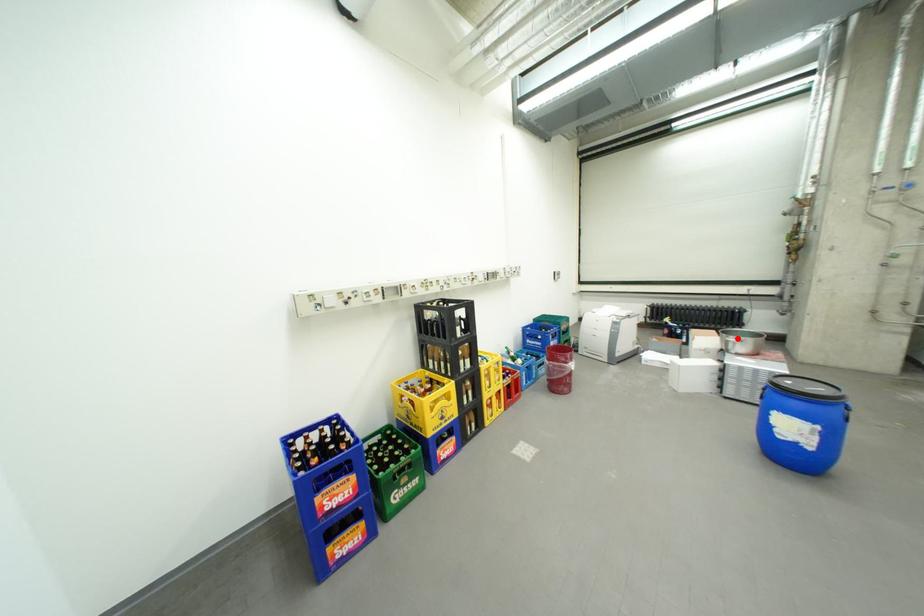
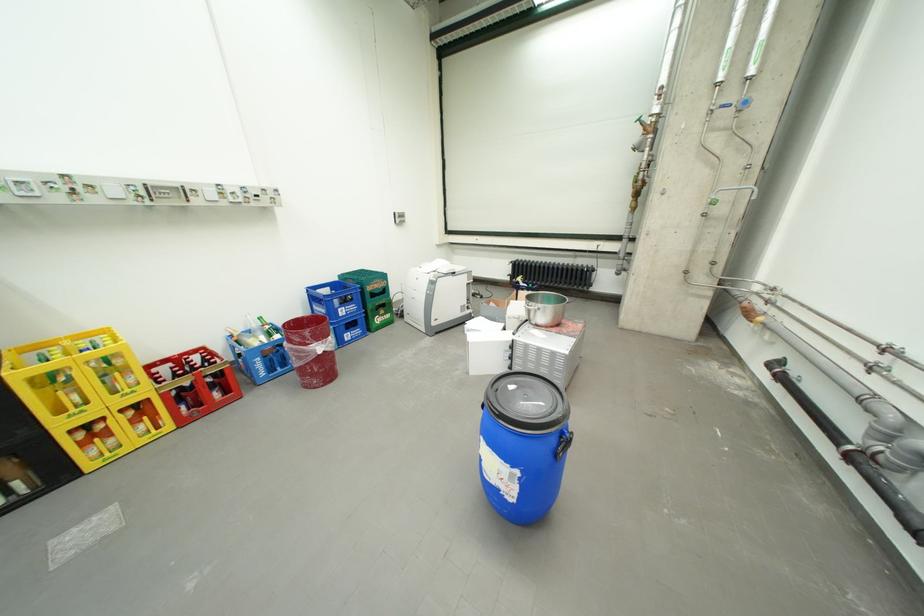
Question: I am providing you with two images of the same scene from different viewpoints. Given a red point in image1, look at the same physical point in image2. Is it:

Choices:
 (A) Closer to the viewpoint
 (B) Farther from the viewpoint

Answer: (A)